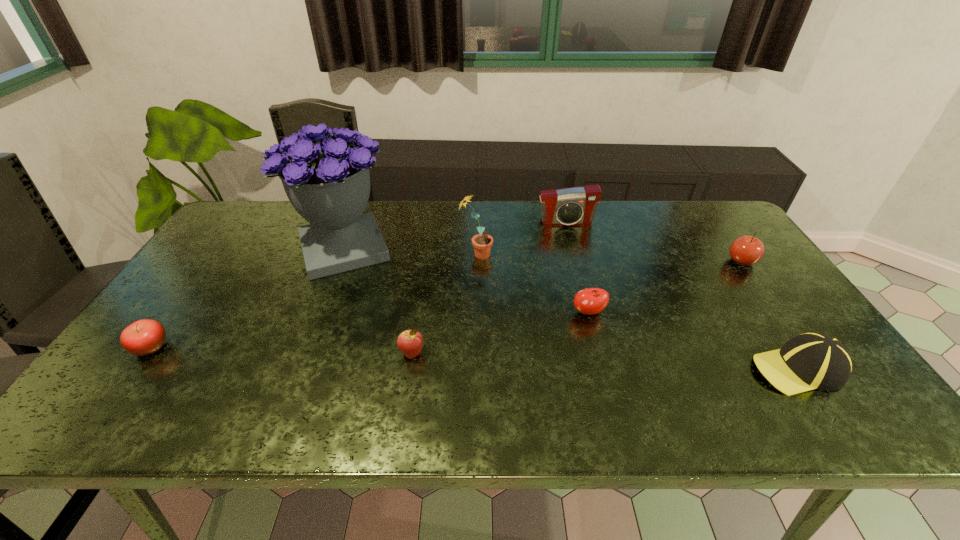
Identify the location of vacant area that lies between the second apple from left to right and the leftmost object. This screenshot has height=540, width=960. (x=281, y=350).

You are a GUI agent. You are given a task and a screenshot of the screen. Output one action in this format:
    pyautogui.click(x=<x>, y=<y>)
    Task: Click on the vacant point located between the leftmost object and the third apple from left to right
    Image resolution: width=960 pixels, height=540 pixels.
    Given the screenshot: What is the action you would take?
    pyautogui.click(x=370, y=330)

At what (x,y) coordinates should I click in order to perform the action: click on free space between the seventh shortest object and the baseball cap. Please return your answer as a coordinate pair (x, y). The width and height of the screenshot is (960, 540). Looking at the image, I should click on (636, 312).

Find the location of `free spot between the third apple from right to left and the sunflower`. free spot between the third apple from right to left and the sunflower is located at coordinates (444, 304).

At what (x,y) coordinates should I click in order to perform the action: click on vacant space that's between the leftmost object and the fifth object from right to left. Please return your answer as a coordinate pair (x, y). The height and width of the screenshot is (540, 960). Looking at the image, I should click on (314, 301).

Find the location of a particular element. The height and width of the screenshot is (540, 960). the sixth closest object to the third tallest object is located at coordinates (410, 342).

Identify which object is located as the fourth nearest to the sixth shortest object. Please provide its 2D coordinates. Your answer should be formatted as a tuple, i.e. [(x, y)], where the tuple contains the x and y coordinates of a point satisfying the conditions above.

[(328, 184)]

Choose which apple is the nearest neighbor to the fifth object from right to left. Please provide its 2D coordinates. Your answer should be formatted as a tuple, i.e. [(x, y)], where the tuple contains the x and y coordinates of a point satisfying the conditions above.

[(589, 301)]

This screenshot has width=960, height=540. In order to click on apple that is the closest to the fifth object from right to left in this screenshot , I will do `click(589, 301)`.

You are a GUI agent. You are given a task and a screenshot of the screen. Output one action in this format:
    pyautogui.click(x=<x>, y=<y>)
    Task: Click on the free space that satisfies the following two spatial constraints: 1. on the flower of the fifth object from right to left; 2. on the right side of the second apple from right to left
    The height and width of the screenshot is (540, 960).
    Given the screenshot: What is the action you would take?
    pyautogui.click(x=475, y=312)